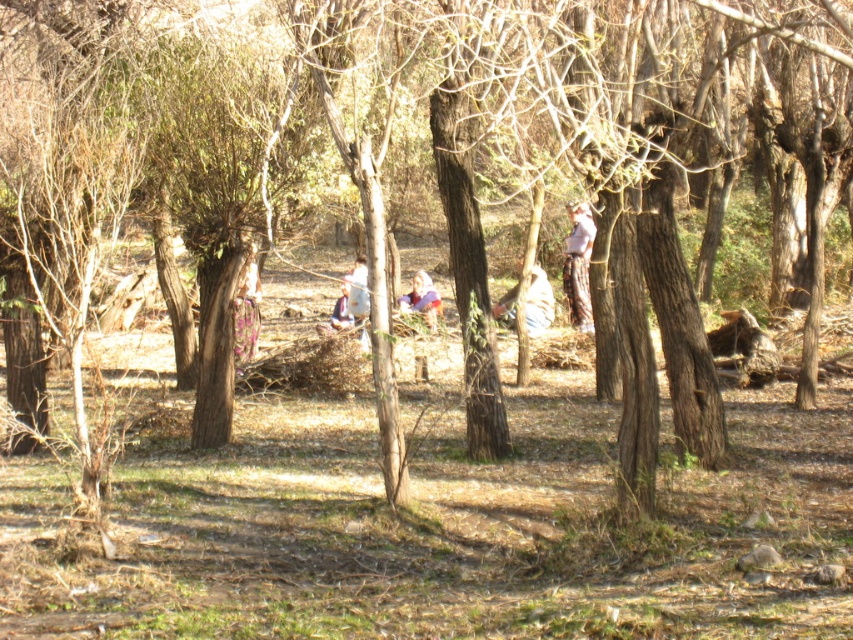
Which is above, light blue fabric at center or white fabric cloth at center?

Positioned higher is white fabric cloth at center.

Between point (402, 298) and point (357, 272), which one is positioned behind?

The point (357, 272) is more distant.

Where is `light blue fabric at center`? This screenshot has width=853, height=640. light blue fabric at center is located at coordinates (422, 300).

How distant is light brown fabric pants at center from light beige fabric at center?

light brown fabric pants at center is 77.39 centimeters away from light beige fabric at center.

Can you confirm if light brown fabric pants at center is positioned below light beige fabric at center?

Incorrect, light brown fabric pants at center is not positioned below light beige fabric at center.

Which is behind, point (582, 320) or point (514, 301)?

The point (514, 301) is more distant.

What are the coordinates of `light brown fabric pants at center` in the screenshot? It's located at (578, 266).

What are the coordinates of `floral fabric dress at center` in the screenshot? It's located at (247, 312).

In the scene shown: Can you confirm if floral fabric dress at center is taller than white fabric cloth at center?

Yes.

Identify the location of floral fabric dress at center. (247, 312).